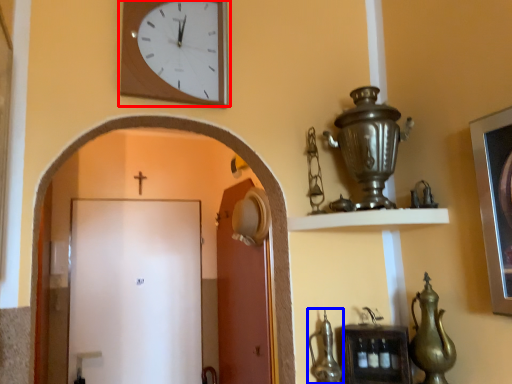
Question: Which object appears farthest to the camera in this image, wall clock (highlighted by a red box) or tea pot (highlighted by a blue box)?

Choices:
 (A) wall clock
 (B) tea pot

Answer: (B)